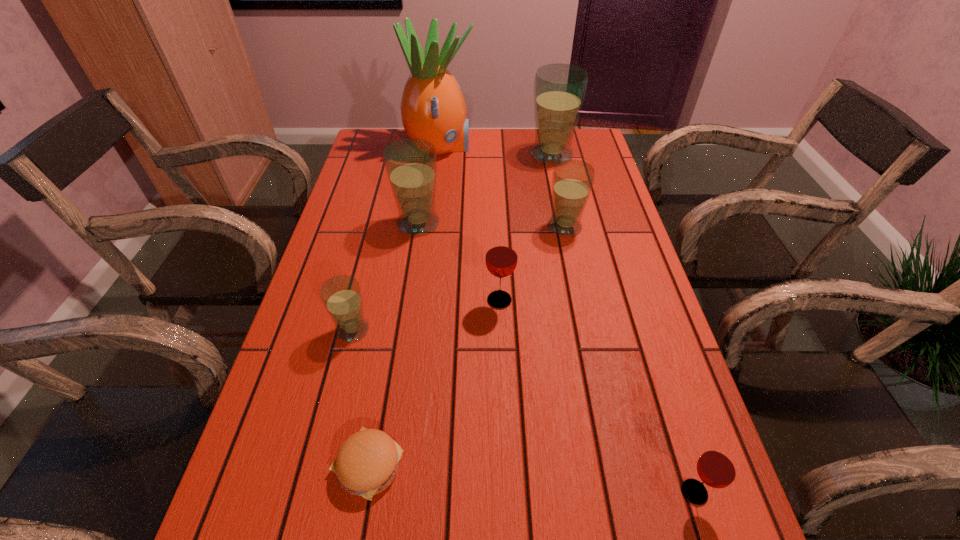
What are the coordinates of `pineapple` in the screenshot? It's located at (432, 107).

What are the coordinates of `the tallest object` in the screenshot? It's located at [x=432, y=107].

Where is `the tallest glass`? the tallest glass is located at coordinates pos(559,89).

Image resolution: width=960 pixels, height=540 pixels. What are the coordinates of `the biggest blue glass` in the screenshot? It's located at (559, 89).

Image resolution: width=960 pixels, height=540 pixels. In order to click on the third tallest object in this screenshot , I will do `click(411, 164)`.

Where is `the second glass from left to right`? the second glass from left to right is located at coordinates (411, 164).

Where is `the second smallest blue glass`? the second smallest blue glass is located at coordinates (572, 180).

This screenshot has width=960, height=540. Find the location of `the third glass from left to right`. the third glass from left to right is located at coordinates (501, 258).

Where is `the fourth nearest object`? the fourth nearest object is located at coordinates [x=501, y=258].

This screenshot has height=540, width=960. What are the coordinates of `the leftmost blue glass` in the screenshot? It's located at (341, 295).